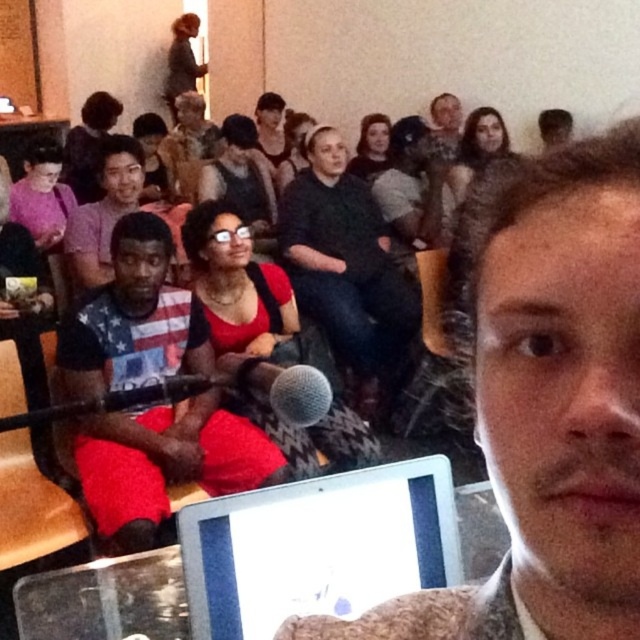
Is silver metallic laptop at center taller than dark gray sweater at center?

No, silver metallic laptop at center is not taller than dark gray sweater at center.

The image size is (640, 640). What do you see at coordinates (317, 547) in the screenshot? I see `silver metallic laptop at center` at bounding box center [317, 547].

You are a GUI agent. You are given a task and a screenshot of the screen. Output one action in this format:
    pyautogui.click(x=<x>, y=<y>)
    Task: Click on the silver metallic laptop at center
    
    Given the screenshot: What is the action you would take?
    pyautogui.click(x=317, y=547)

Does american flag t-shirt at center appear on the left side of silver metallic laptop at center?

Indeed, american flag t-shirt at center is positioned on the left side of silver metallic laptop at center.

Between american flag t-shirt at center and silver metallic laptop at center, which one has more height?

american flag t-shirt at center

Is point (209, 444) farther from viewer compared to point (378, 492)?

Yes, point (209, 444) is farther from viewer.

Identify the location of american flag t-shirt at center. The image size is (640, 640). (164, 461).

Which is more to the right, smooth brown hair at center or american flag t-shirt at center?

smooth brown hair at center

Can you confirm if smooth brown hair at center is shorter than american flag t-shirt at center?

Result: Incorrect, smooth brown hair at center's height does not fall short of american flag t-shirt at center's.

Find the location of `smooth brown hair at center`. smooth brown hair at center is located at coordinates (544, 401).